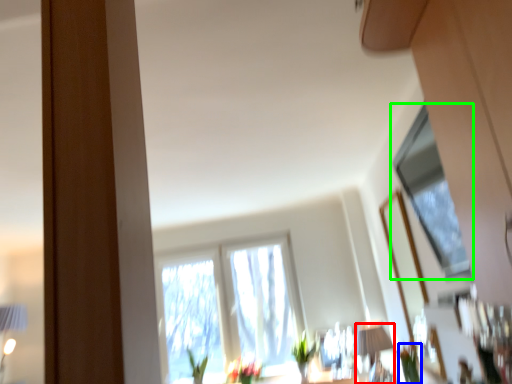
Question: Estimate the real-world distances between objects in this image. Which object is farther from table lamp (highlighted by a red box), plant (highlighted by a blue box) or window (highlighted by a green box)?

Choices:
 (A) plant
 (B) window

Answer: (B)